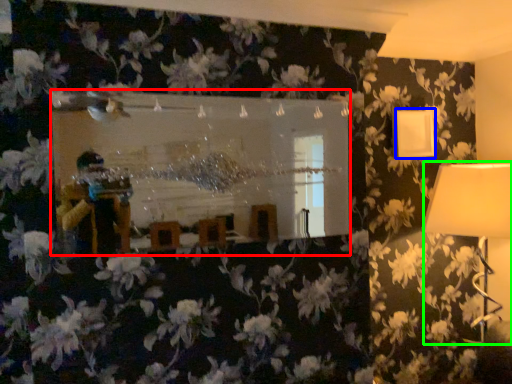
Question: Which object is positioned farthest from mirror (highlighted by a red box)? Select from lamp (highlighted by a blue box) and lamp (highlighted by a green box).

Choices:
 (A) lamp
 (B) lamp

Answer: (B)